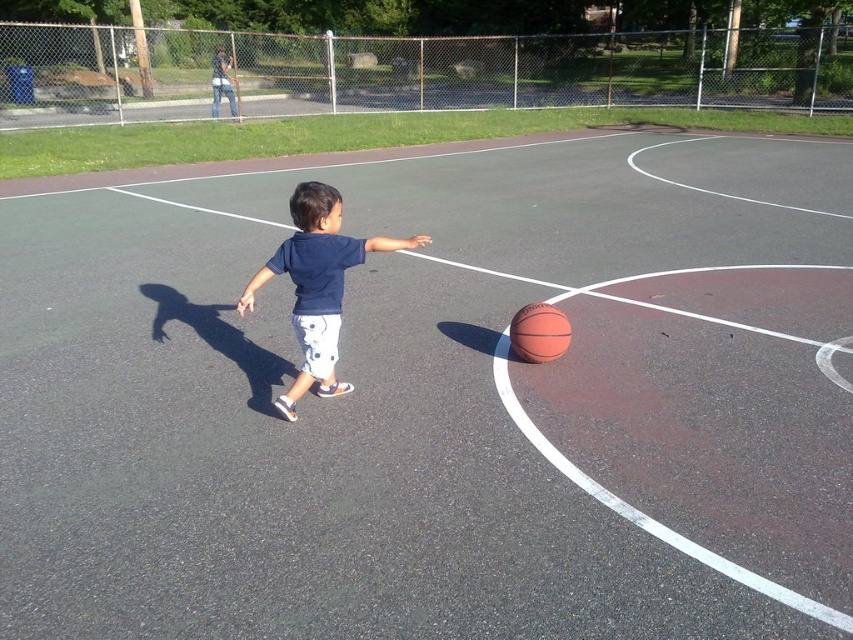
Question: Is dark blue cotton shirt at center to the left of rubber/synthetic basketball at center from the viewer's perspective?

Choices:
 (A) yes
 (B) no

Answer: (A)

Question: Among these points, which one is farthest from the camera?

Choices:
 (A) (329, 236)
 (B) (532, 337)

Answer: (B)

Question: Can you confirm if dark blue cotton shirt at center is smaller than rubber/synthetic basketball at center?

Choices:
 (A) yes
 (B) no

Answer: (B)

Question: Is dark blue cotton shirt at center wider than rubber/synthetic basketball at center?

Choices:
 (A) yes
 (B) no

Answer: (A)